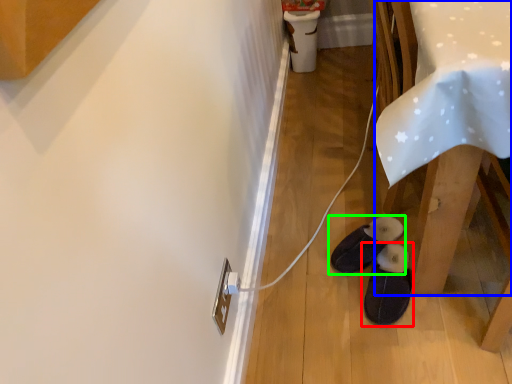
Question: Considering the real-world distances, which object is farthest from footwear (highlighted by a red box)? table (highlighted by a blue box) or footwear (highlighted by a green box)?

Choices:
 (A) table
 (B) footwear

Answer: (A)